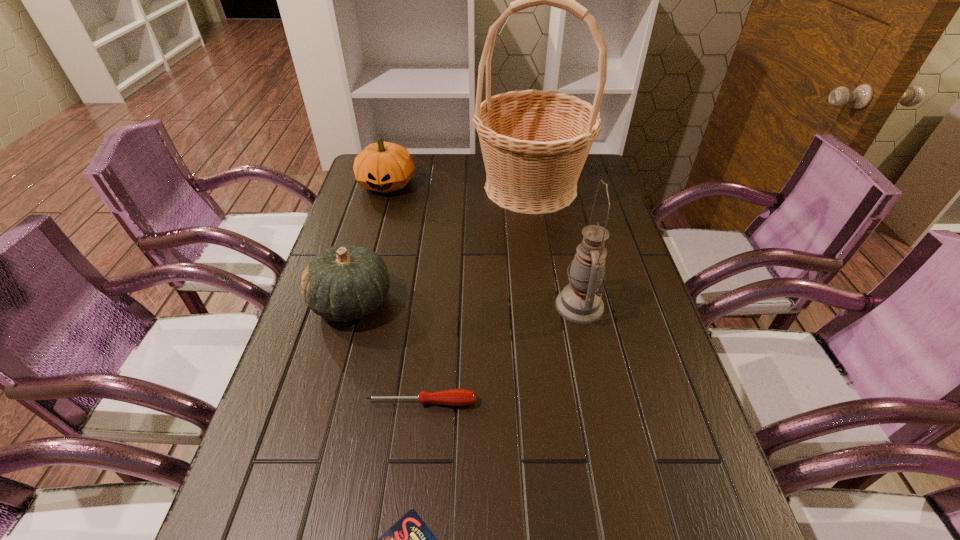
The height and width of the screenshot is (540, 960). What are the coordinates of `free location located on the back of the second nearest object` in the screenshot? It's located at (424, 374).

The width and height of the screenshot is (960, 540). What are the coordinates of `basket positioned at the far edge` in the screenshot? It's located at (534, 143).

Where is `gourd at the far edge`? This screenshot has width=960, height=540. gourd at the far edge is located at coordinates (384, 167).

The image size is (960, 540). What are the coordinates of `basket that is positioned at the right edge` in the screenshot? It's located at (534, 143).

Where is `oil lamp present at the right edge`? oil lamp present at the right edge is located at coordinates (580, 302).

This screenshot has width=960, height=540. I want to click on object that is at the far left corner, so click(384, 167).

What are the coordinates of `object at the far right corner` in the screenshot? It's located at (534, 143).

This screenshot has width=960, height=540. In order to click on free space at the far edge in this screenshot , I will do `click(482, 174)`.

In the image, there is a desktop. At what (x,y) coordinates should I click in order to perform the action: click on vacant space at the left edge. Please return your answer as a coordinate pair (x, y). The width and height of the screenshot is (960, 540). Looking at the image, I should click on (255, 464).

In the image, there is a desktop. At what (x,y) coordinates should I click in order to perform the action: click on vacant space at the right edge. Please return your answer as a coordinate pair (x, y). This screenshot has height=540, width=960. Looking at the image, I should click on (730, 519).